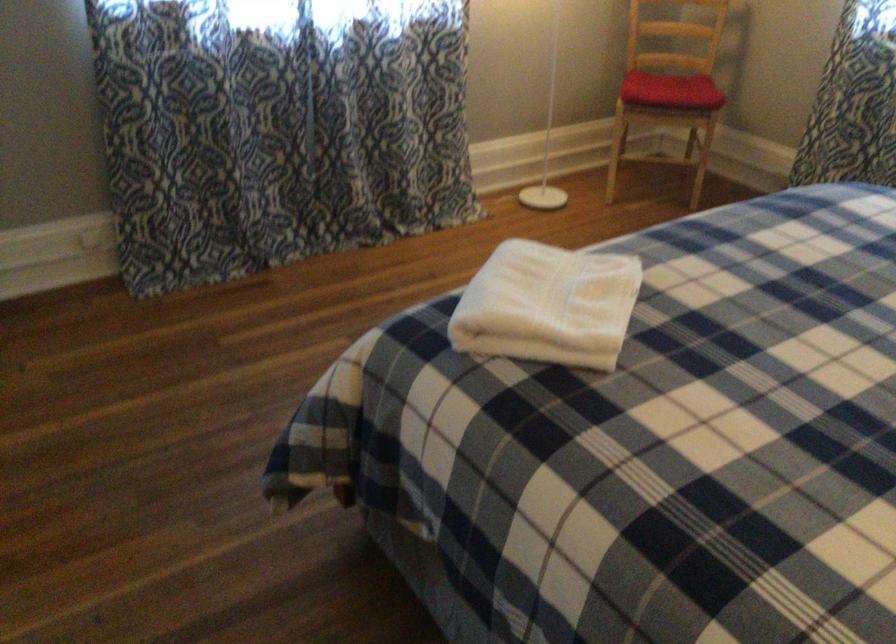
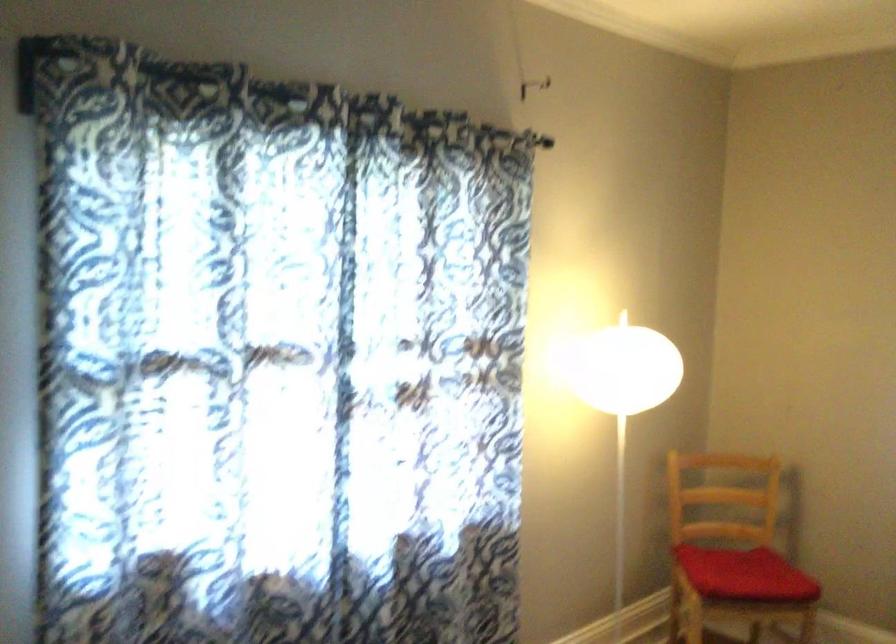
In a continuous first-person perspective shot, in which direction is the camera moving?

The cameraman walked toward left, forward.